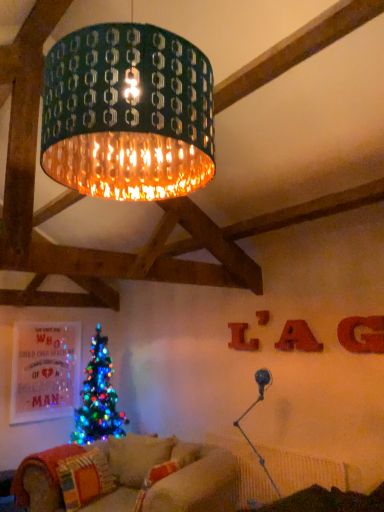
Question: In the image, is red felt letter g at upper right, which appears as the first letter when viewed from the front, on the left side or the right side of matte red letter at upper right, marked as the 1th letter in a back-to-front arrangement?

Choices:
 (A) right
 (B) left

Answer: (A)

Question: From their relative heights in the image, would you say red felt letter g at upper right, which appears as the first letter when viewed from the front, is taller or shorter than matte red letter at upper right, the 4th letter in the front-to-back sequence?

Choices:
 (A) tall
 (B) short

Answer: (B)

Question: Estimate the real-world distances between objects in this image. Which object is farther from the matte red letter at upper right, the 4th letter in the front-to-back sequence?

Choices:
 (A) red felt letter g at upper right, positioned as the fourth letter in back-to-front order
 (B) white textured pillow at lower center, which is the second pillow from left to right
 (C) multicolored fabric pillow at lower left, which appears as the 2th pillow when viewed from the right
 (D) matte red letter at upper right, the third letter in the back-to-front sequence
 (E) metallic silver table lamp at lower right

Answer: (C)

Question: Estimate the real-world distances between objects in this image. Which object is farther from the red felt letter g at upper right, positioned as the fourth letter in back-to-front order?

Choices:
 (A) multicolored fabric pillow at lower left, which appears as the 2th pillow when viewed from the right
 (B) wooden letter at center right, marked as the second letter in a back-to-front arrangement
 (C) matte red letter at upper right, positioned as the 1th letter in left-to-right order
 (D) white textured pillow at lower center, which is the 1th pillow from right to left
 (E) metallic silver table lamp at lower right

Answer: (A)